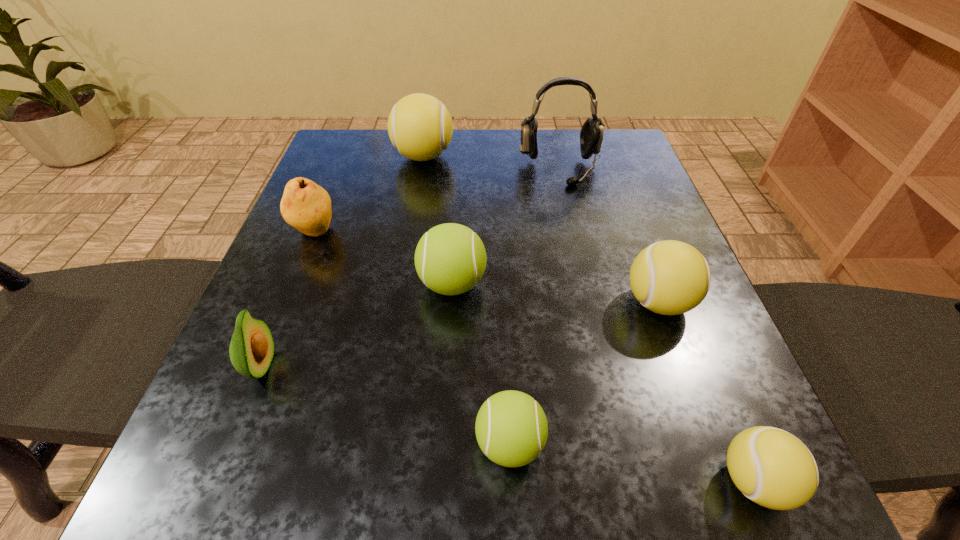
Locate which object is the third closest to the second biggest yellow tennis ball. Please provide its 2D coordinates. Your answer should be formatted as a tuple, i.e. [(x, y)], where the tuple contains the x and y coordinates of a point satisfying the conditions above.

[(450, 259)]

Identify which tennis ball is located as the third nearest to the third nearest object. Please provide its 2D coordinates. Your answer should be formatted as a tuple, i.e. [(x, y)], where the tuple contains the x and y coordinates of a point satisfying the conditions above.

[(420, 127)]

The width and height of the screenshot is (960, 540). I want to click on tennis ball that can be found as the third closest to the bigger green tennis ball, so click(x=420, y=127).

Locate an element on the screen. the second closest yellow tennis ball to the headset is located at coordinates (670, 277).

Image resolution: width=960 pixels, height=540 pixels. Identify the location of yellow tennis ball object that ranks as the third closest to the avocado. (773, 468).

You are a GUI agent. You are given a task and a screenshot of the screen. Output one action in this format:
    pyautogui.click(x=<x>, y=<y>)
    Task: Click on the free space that satisfies the following two spatial constraints: 1. on the front side of the nearest yellow tennis ball; 2. on the right side of the farthest yellow tennis ball
    The height and width of the screenshot is (540, 960).
    Given the screenshot: What is the action you would take?
    pyautogui.click(x=369, y=481)

Find the location of a particular element. Image resolution: width=960 pixels, height=540 pixels. blank area in the image that satisfies the following two spatial constraints: 1. on the cut side of the avocado; 2. on the left side of the smaller green tennis ball is located at coordinates (229, 443).

I want to click on blank area in the image that satisfies the following two spatial constraints: 1. with the microphone on the side of the second smallest yellow tennis ball; 2. on the right side of the tallest object, so click(x=590, y=302).